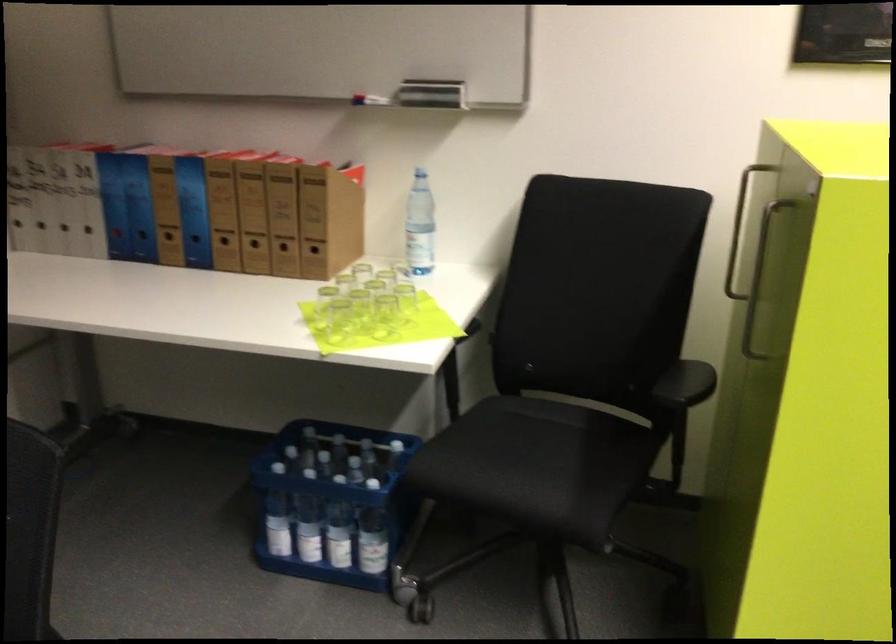
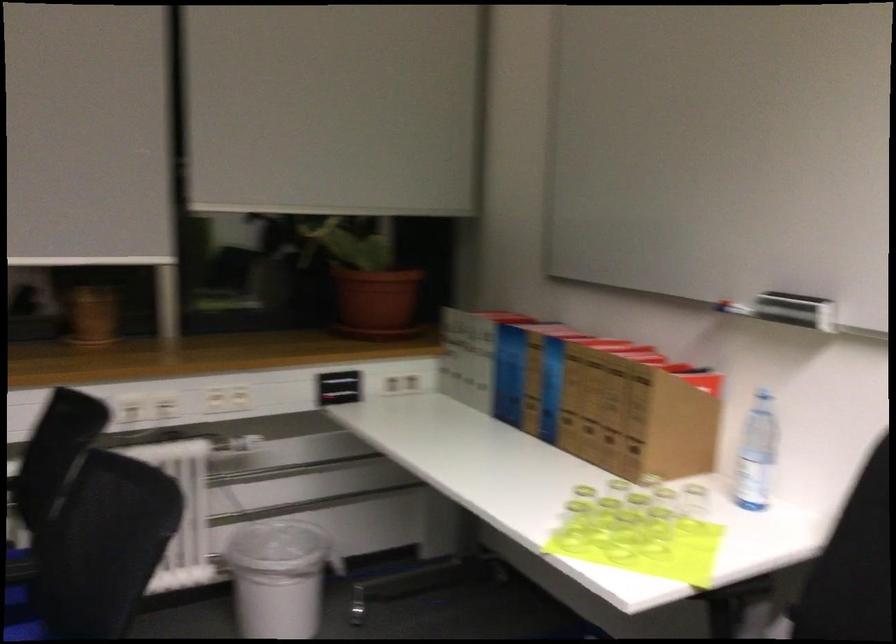
Locate, in the second image, the point that corresponds to point (308, 220) in the first image.

(634, 417)